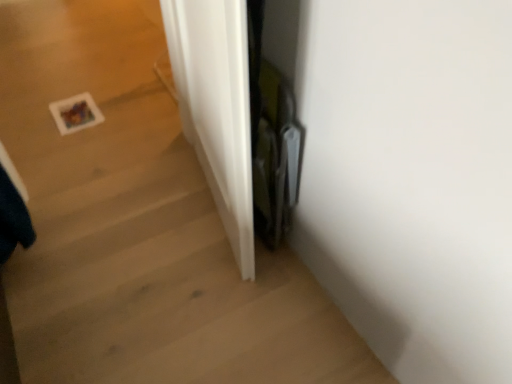
In order to click on vacant space that is to the left of black glossy screen door at center in this screenshot , I will do `click(203, 265)`.